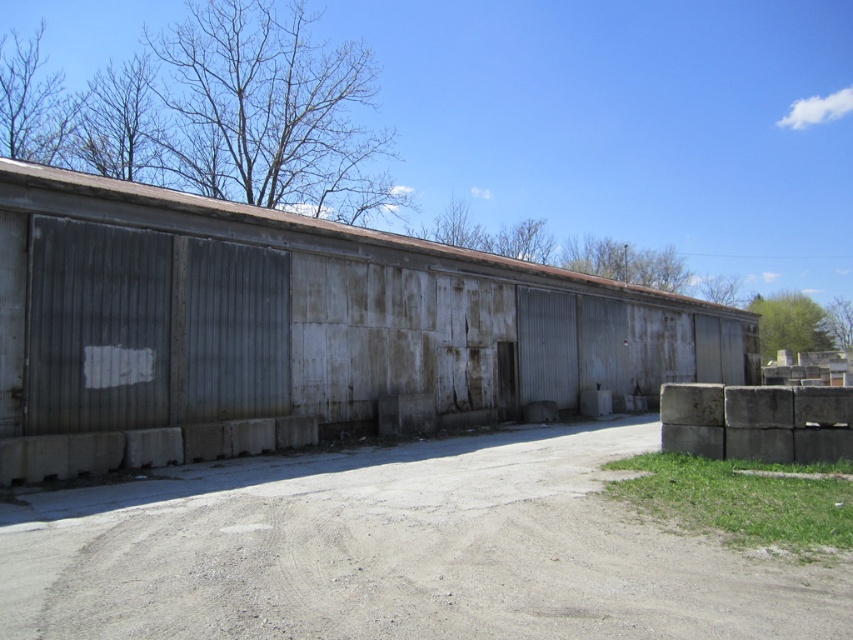
You are a delivery driver who needs to park your truck near the rusty corrugated metal shed at center. The gray gravel dirt track at center is the only path leading to the shed. Based on the scene, can you determine if the truck can safely navigate the path to reach the shed?

The rusty corrugated metal shed at center is to the right of the gray gravel dirt track at center, so the truck can safely navigate the path along the gray gravel dirt track at center to reach the shed as there is no obstruction mentioned.

You are driving a delivery truck that needs to park on the gray gravel dirt track at center near the rusty corrugated metal shed at center. However, your truck has a height restriction of 2 meters. Can you safely park there without hitting the shed?

The rusty corrugated metal shed at center is positioned over the gray gravel dirt track at center, but since the shed is a structure, its height isn